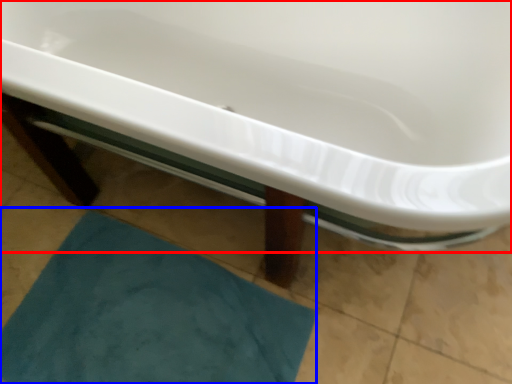
Question: Which object appears farthest to the camera in this image, bathtub (highlighted by a red box) or bath mat (highlighted by a blue box)?

Choices:
 (A) bathtub
 (B) bath mat

Answer: (B)